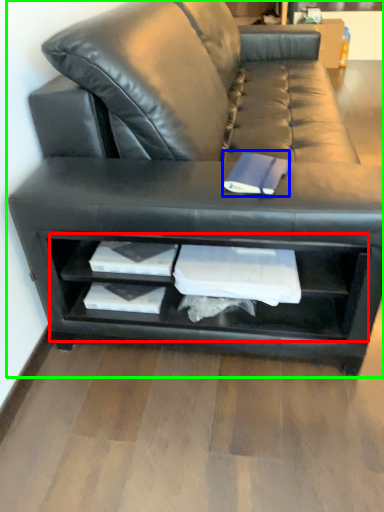
Question: Which object is positioned farthest from shelf (highlighted by a red box)? Select from paperback book (highlighted by a blue box) and studio couch (highlighted by a green box).

Choices:
 (A) paperback book
 (B) studio couch

Answer: (A)